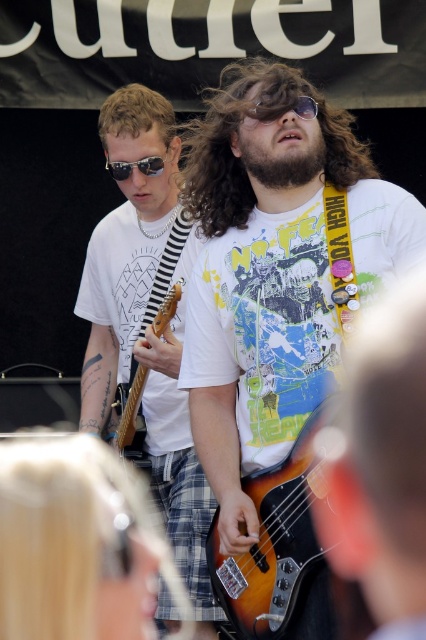
Based on the scene description, which object is larger in size between the blondehair at left and the sunglasses at center?

The blondehair at left is bigger than the sunglasses at center according to the description.